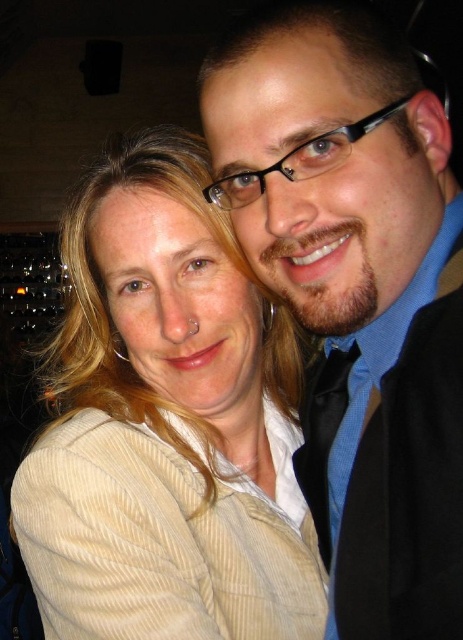
You are a photographer trying to adjust the lighting for a photo shoot. You notice the beige corduroy jacket at upper left is represented by point (167,424). Where should you position the key light to ensure the jacket is well illuminated?

The beige corduroy jacket at upper left is represented by point (167,424). To ensure proper illumination, position the key light in front of the jacket, slightly to the side opposite the point to create even lighting.

You are holding a camera and want to take a photo of the two people in the scene. The camera has a focus range of 30 to 35 inches. Is the point at coordinates point (243, 438) within the focus range?

The distance of point (243, 438) from the camera is 34.49 inches, which falls within the camera focus range of 30 to 35 inches. Therefore, the point is within the focus range.